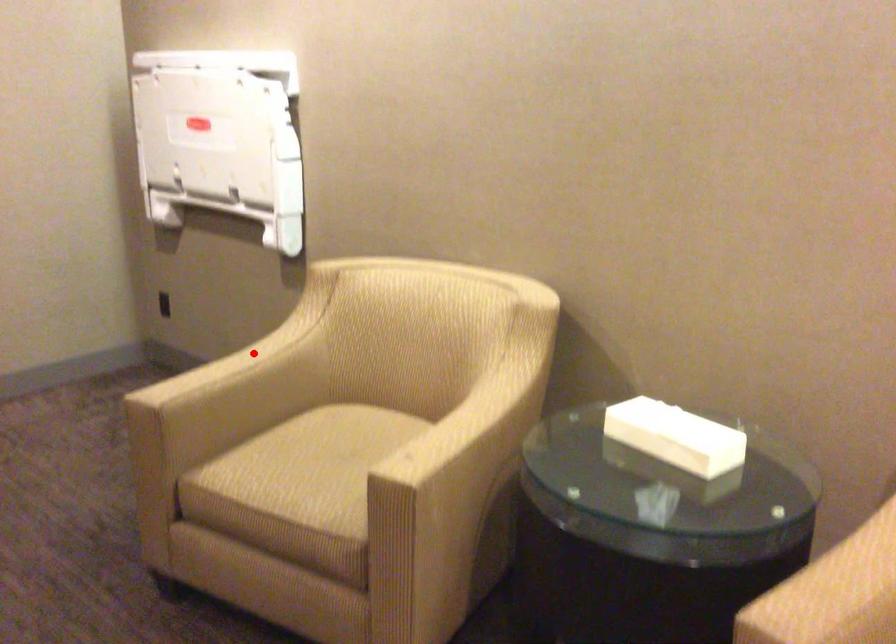
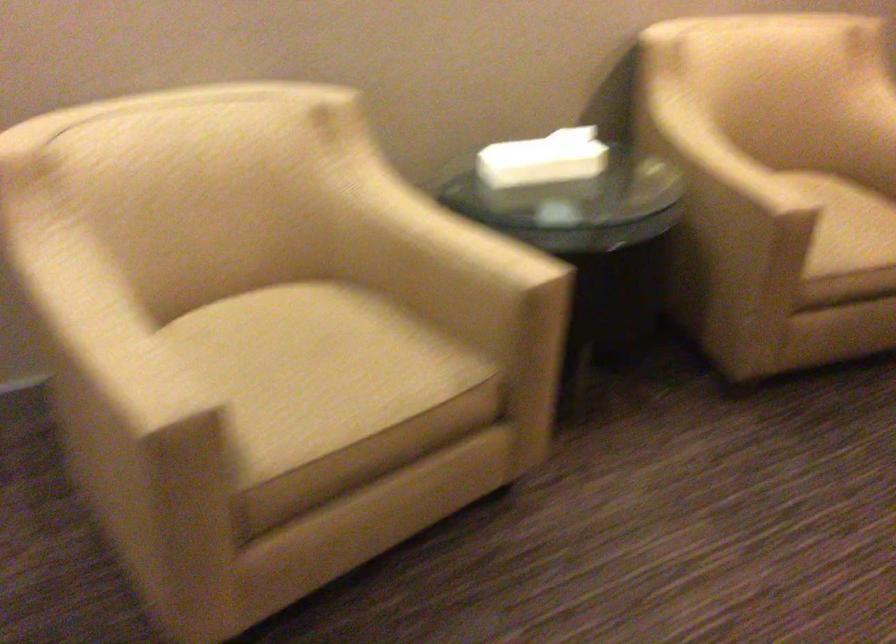
Where in the second image is the point corresponding to the highlighted location from the first image?

(89, 304)